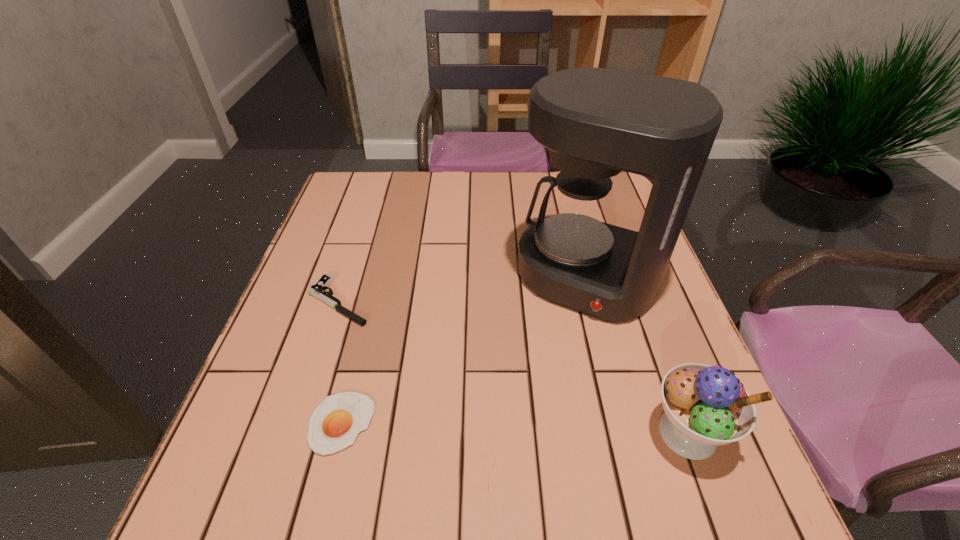
At what (x,y) coordinates should I click in order to perform the action: click on vacant space located 0.080m on the front-facing side of the tallest object. Please return your answer as a coordinate pair (x, y). The image size is (960, 540). Looking at the image, I should click on (549, 346).

You are a GUI agent. You are given a task and a screenshot of the screen. Output one action in this format:
    pyautogui.click(x=<x>, y=<y>)
    Task: Click on the vacant space located on the front-facing side of the tallest object
    
    Given the screenshot: What is the action you would take?
    pyautogui.click(x=499, y=442)

I want to click on egg yolk at the near edge, so click(x=335, y=423).

Image resolution: width=960 pixels, height=540 pixels. Find the location of `icecream that is at the near edge`. icecream that is at the near edge is located at coordinates (705, 406).

This screenshot has height=540, width=960. Find the location of `egg yolk located in the left edge section of the desktop`. egg yolk located in the left edge section of the desktop is located at coordinates (335, 423).

Where is `pistol that is at the left edge`? pistol that is at the left edge is located at coordinates (319, 290).

The height and width of the screenshot is (540, 960). I want to click on icecream that is at the right edge, so click(x=705, y=406).

Locate an element on the screen. Image resolution: width=960 pixels, height=540 pixels. coffee maker that is at the right edge is located at coordinates (595, 122).

You are a GUI agent. You are given a task and a screenshot of the screen. Output one action in this format:
    pyautogui.click(x=<x>, y=<y>)
    Task: Click on the object positioned at the near left corner
    The image size is (960, 540).
    Given the screenshot: What is the action you would take?
    pyautogui.click(x=335, y=423)

Locate an element on the screen. object that is at the near right corner is located at coordinates (705, 406).